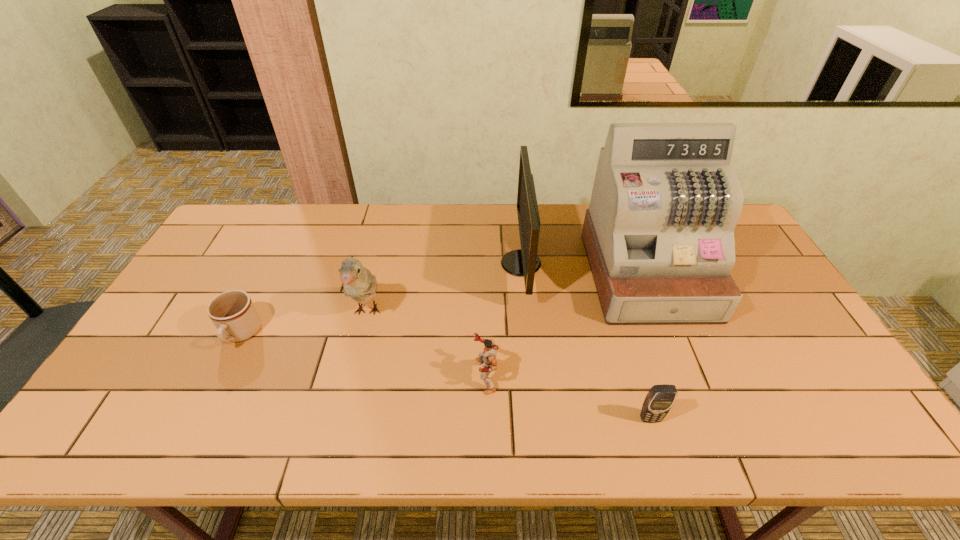
Locate an element on the screen. free spot between the second nearest object and the cellular telephone is located at coordinates (567, 397).

Identify the location of empty location between the bird and the computer monitor. The width and height of the screenshot is (960, 540). (444, 288).

Locate an element on the screen. The image size is (960, 540). vacant area that lies between the nearest object and the leftmost object is located at coordinates (445, 376).

At what (x,y) coordinates should I click in order to perform the action: click on free point between the shortest object and the third object from right to left. Please return your answer as a coordinate pair (x, y). Looking at the image, I should click on (380, 299).

Locate an element on the screen. The image size is (960, 540). unoccupied area between the cash register and the computer monitor is located at coordinates (584, 269).

Image resolution: width=960 pixels, height=540 pixels. I want to click on unoccupied position between the second tallest object and the mug, so click(x=380, y=299).

Find the location of a particular element. The width and height of the screenshot is (960, 540). object that is the third closest one to the bird is located at coordinates (524, 262).

I want to click on object that can be found as the fourth closest to the second tallest object, so point(660,398).

Identify the location of free space in the image that satisfies the following two spatial constraints: 1. on the front-facing side of the third object from right to left; 2. at the face of the bird. (525, 312).

Image resolution: width=960 pixels, height=540 pixels. Identify the location of vacant point that satisfies the following two spatial constraints: 1. on the front-facing side of the third object from right to left; 2. on the side of the shortest object with the handle. (528, 334).